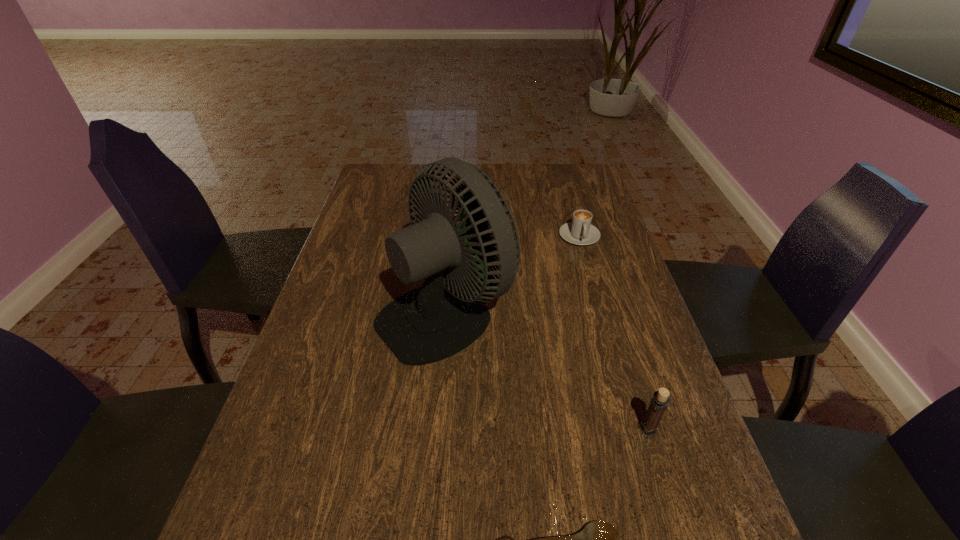
Where is `the closest object to the second farthest object`? The height and width of the screenshot is (540, 960). the closest object to the second farthest object is located at coordinates (580, 231).

Image resolution: width=960 pixels, height=540 pixels. I want to click on blank space that satisfies the following two spatial constraints: 1. to the right of the third shortest object; 2. on the left side of the third tallest object, so 636,430.

At what (x,y) coordinates should I click in order to perform the action: click on free region that satisfies the following two spatial constraints: 1. to the right of the farthest object; 2. on the right side of the second tallest object. Please return your answer as a coordinate pair (x, y). The height and width of the screenshot is (540, 960). Looking at the image, I should click on (636, 430).

Identify the location of vacant area that satisfies the following two spatial constraints: 1. to the right of the farthest object; 2. on the left side of the second tallest object. (636, 430).

Image resolution: width=960 pixels, height=540 pixels. In order to click on free spot that satisfies the following two spatial constraints: 1. to the right of the third tallest object; 2. in front of the fan to direct airflow in this screenshot , I will do `click(601, 312)`.

Where is `blank area in the image that satisfies the following two spatial constraints: 1. on the back side of the candle holder; 2. in front of the tallest object to direct airflow`? The height and width of the screenshot is (540, 960). blank area in the image that satisfies the following two spatial constraints: 1. on the back side of the candle holder; 2. in front of the tallest object to direct airflow is located at coordinates (611, 312).

Find the location of a particular element. This screenshot has width=960, height=540. free spot that satisfies the following two spatial constraints: 1. on the back side of the candle holder; 2. in front of the fan to direct airflow is located at coordinates (611, 312).

At what (x,y) coordinates should I click in order to perform the action: click on free location that satisfies the following two spatial constraints: 1. to the right of the cappuccino; 2. in front of the third nearest object to direct airflow. Please return your answer as a coordinate pair (x, y). The width and height of the screenshot is (960, 540). Looking at the image, I should click on (601, 312).